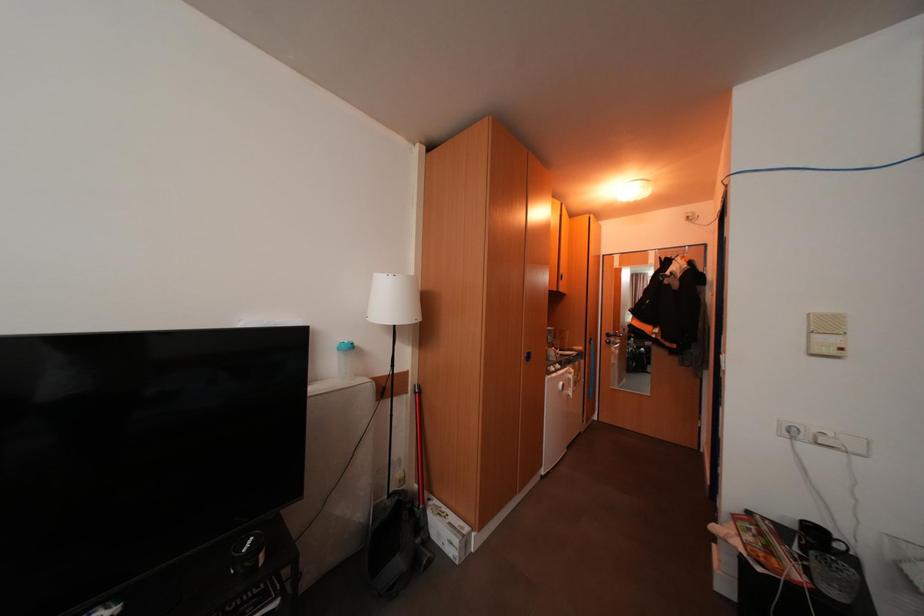
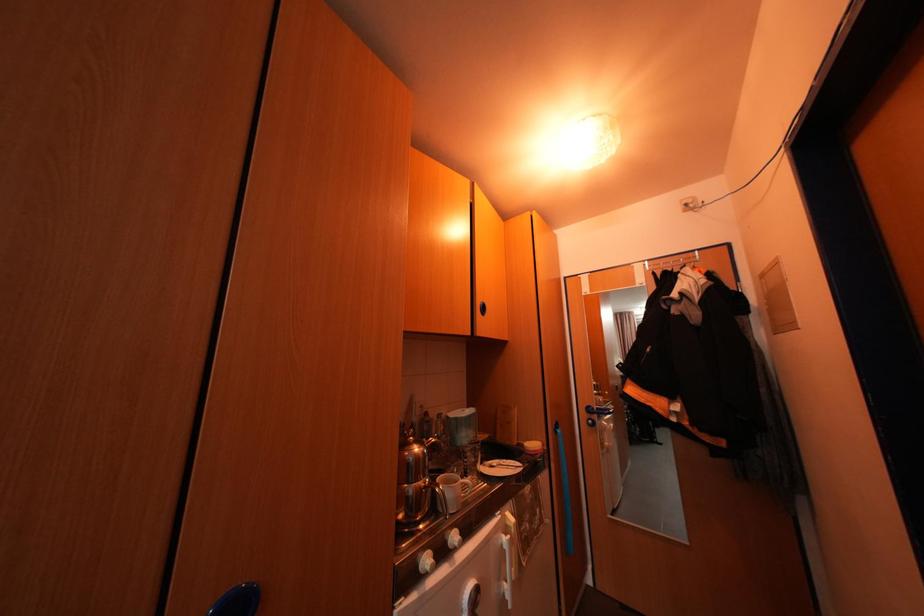
The images are taken continuously from a first-person perspective. In which direction are you moving?

The cameraman moved toward right, forward.